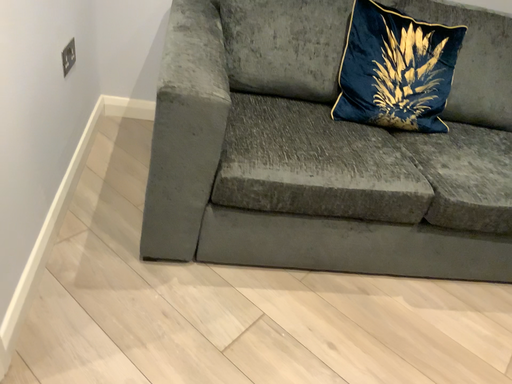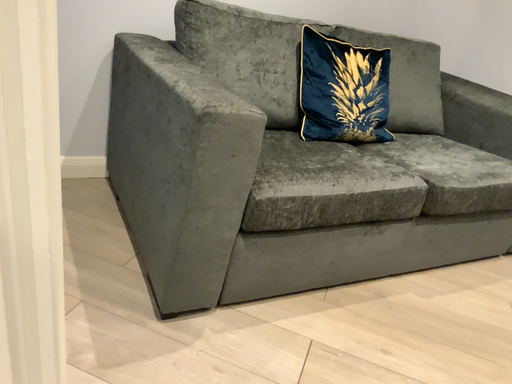
Question: Which way did the camera rotate in the video?

Choices:
 (A) rotated right
 (B) rotated left

Answer: (A)